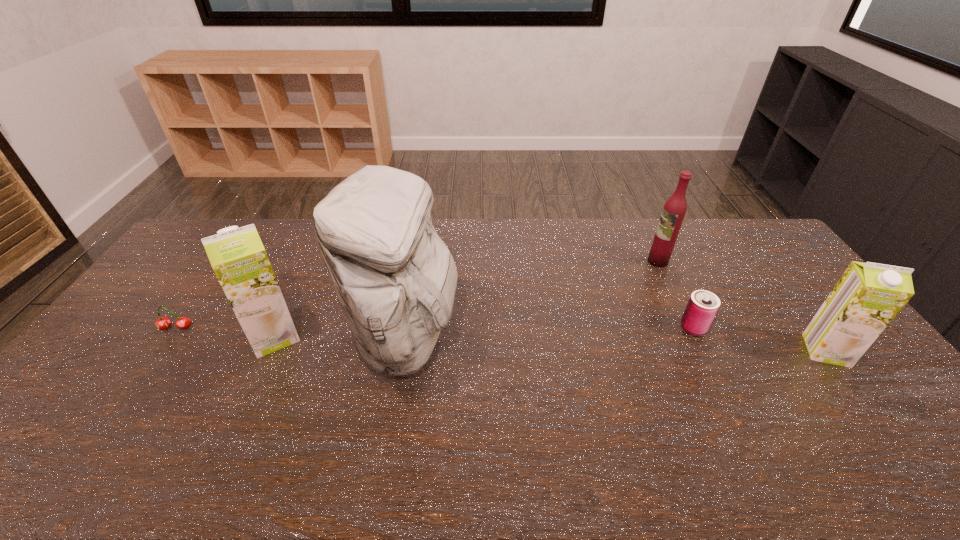
Identify the location of vacant space located 0.340m on the back of the left soya milk. (315, 249).

The height and width of the screenshot is (540, 960). Find the location of `vacant space located on the left of the right soya milk`. vacant space located on the left of the right soya milk is located at coordinates (773, 350).

Image resolution: width=960 pixels, height=540 pixels. I want to click on vacant region located with stems pointing upwards on the cherry, so click(128, 398).

At what (x,y) coordinates should I click in order to perform the action: click on free space located on the left of the second shortest object. Please return your answer as a coordinate pair (x, y). Looking at the image, I should click on (587, 327).

Where is `free spot located on the label of the farthest object`? This screenshot has width=960, height=540. free spot located on the label of the farthest object is located at coordinates (560, 261).

What are the coordinates of `free spot located 0.330m on the label of the farthest object` in the screenshot? It's located at (555, 261).

The height and width of the screenshot is (540, 960). What are the coordinates of `free space located on the label of the farthest object` in the screenshot? It's located at (574, 261).

Locate an element on the screen. free spot located on the front-facing side of the third object from left to right is located at coordinates (548, 339).

At what (x,y) coordinates should I click in order to perform the action: click on object located at the far edge. Please return your answer as a coordinate pair (x, y). The width and height of the screenshot is (960, 540). Looking at the image, I should click on (674, 209).

Locate an element on the screen. The height and width of the screenshot is (540, 960). object that is positioned at the near edge is located at coordinates (395, 279).